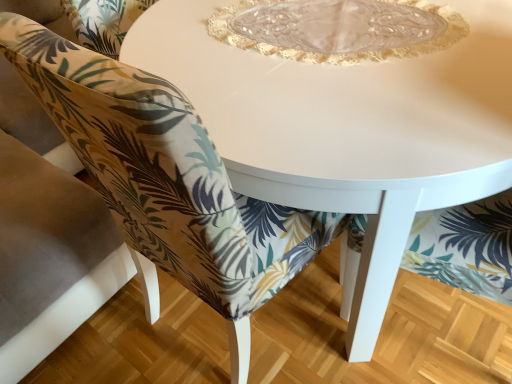
What is the approximate height of white glossy table at center?

white glossy table at center is 29.87 inches tall.

What do you see at coordinates (165, 173) in the screenshot? The height and width of the screenshot is (384, 512). I see `printed fabric chair at center` at bounding box center [165, 173].

Measure the distance between point (385, 48) and camera.

Point (385, 48) is 3.31 feet away from camera.

Locate an element on the screen. white glossy table at center is located at coordinates (348, 129).

From a real-world perspective, which is physically above, transparent glass plate at center or white glossy table at center?

transparent glass plate at center, from a real-world perspective.

Is transparent glass plate at center situated inside white glossy table at center or outside?

transparent glass plate at center can be found inside white glossy table at center.

In the scene shown: Is transparent glass plate at center at the right side of white glossy table at center?

In fact, transparent glass plate at center is to the left of white glossy table at center.

How many degrees apart are the facing directions of transparent glass plate at center and white glossy table at center?

There is a 26.7-degree angle between the facing directions of transparent glass plate at center and white glossy table at center.

Is transparent glass plate at center oriented away from printed fabric chair at center?

That's right, transparent glass plate at center is facing away from printed fabric chair at center.

Can you confirm if transparent glass plate at center is wider than printed fabric chair at center?

In fact, transparent glass plate at center might be narrower than printed fabric chair at center.

Considering the relative sizes of transparent glass plate at center and printed fabric chair at center in the image provided, is transparent glass plate at center shorter than printed fabric chair at center?

Correct, transparent glass plate at center is not as tall as printed fabric chair at center.

Is transparent glass plate at center situated inside printed fabric chair at center or outside?

transparent glass plate at center lies outside printed fabric chair at center.

Does printed fabric chair at center have a greater height compared to white glossy table at center?

Indeed, printed fabric chair at center has a greater height compared to white glossy table at center.

From the image's perspective, does printed fabric chair at center appear lower than white glossy table at center?

Incorrect, from the image's perspective, printed fabric chair at center is higher than white glossy table at center.

From a real-world perspective, between printed fabric chair at center and white glossy table at center, who is vertically lower?

white glossy table at center.

Between printed fabric chair at center and white glossy table at center, which one is positioned in front?

white glossy table at center is more forward.

Is white glossy table at center facing away from printed fabric chair at center?

Yes, printed fabric chair at center is at the back of white glossy table at center.

Is point (251, 102) in front of point (160, 197)?

No, (251, 102) is further to viewer.

Which object is thinner, white glossy table at center or printed fabric chair at center?

white glossy table at center.

Based on the photo, in terms of height, does white glossy table at center look taller or shorter compared to printed fabric chair at center?

white glossy table at center is shorter than printed fabric chair at center.

Which of these two, printed fabric chair at center or transparent glass plate at center, is bigger?

With larger size is printed fabric chair at center.

What's the angular difference between printed fabric chair at center and transparent glass plate at center's facing directions?

The angle between the facing direction of printed fabric chair at center and the facing direction of transparent glass plate at center is 26.7 degrees.

From the image's perspective, is printed fabric chair at center under transparent glass plate at center?

Actually, printed fabric chair at center appears above transparent glass plate at center in the image.

From the picture: Measure the distance between printed fabric chair at center and transparent glass plate at center.

printed fabric chair at center and transparent glass plate at center are 20.99 inches apart.

Based on their sizes in the image, would you say white glossy table at center is bigger or smaller than transparent glass plate at center?

In the image, white glossy table at center appears to be larger than transparent glass plate at center.

Does white glossy table at center have a greater width compared to transparent glass plate at center?

Yes, white glossy table at center is wider than transparent glass plate at center.

Is white glossy table at center next to transparent glass plate at center?

No, white glossy table at center is not making contact with transparent glass plate at center.

Is white glossy table at center facing towards transparent glass plate at center?

No, white glossy table at center is not aimed at transparent glass plate at center.

The image size is (512, 384). I want to click on table below the transparent glass plate at center (from a real-world perspective), so click(348, 129).

The width and height of the screenshot is (512, 384). I want to click on glass plate located above the printed fabric chair at center (from a real-world perspective), so click(337, 26).

From the image, which object appears to be farther from white glossy table at center, printed fabric chair at center or transparent glass plate at center?

printed fabric chair at center is further to white glossy table at center.

Based on their spatial positions, is printed fabric chair at center or white glossy table at center further from transparent glass plate at center?

The object further to transparent glass plate at center is printed fabric chair at center.

Which object lies nearer to the anchor point white glossy table at center, transparent glass plate at center or printed fabric chair at center?

transparent glass plate at center lies closer to white glossy table at center than the other object.

Looking at the image, which one is located closer to transparent glass plate at center, white glossy table at center or printed fabric chair at center?

white glossy table at center.

Based on their spatial positions, is white glossy table at center or transparent glass plate at center further from printed fabric chair at center?

transparent glass plate at center is positioned further to the anchor printed fabric chair at center.

Estimate the real-world distances between objects in this image. Which object is further from printed fabric chair at center, transparent glass plate at center or white glossy table at center?

Among the two, transparent glass plate at center is located further to printed fabric chair at center.

Where is `glass plate between printed fabric chair at center and white glossy table at center`? glass plate between printed fabric chair at center and white glossy table at center is located at coordinates click(337, 26).